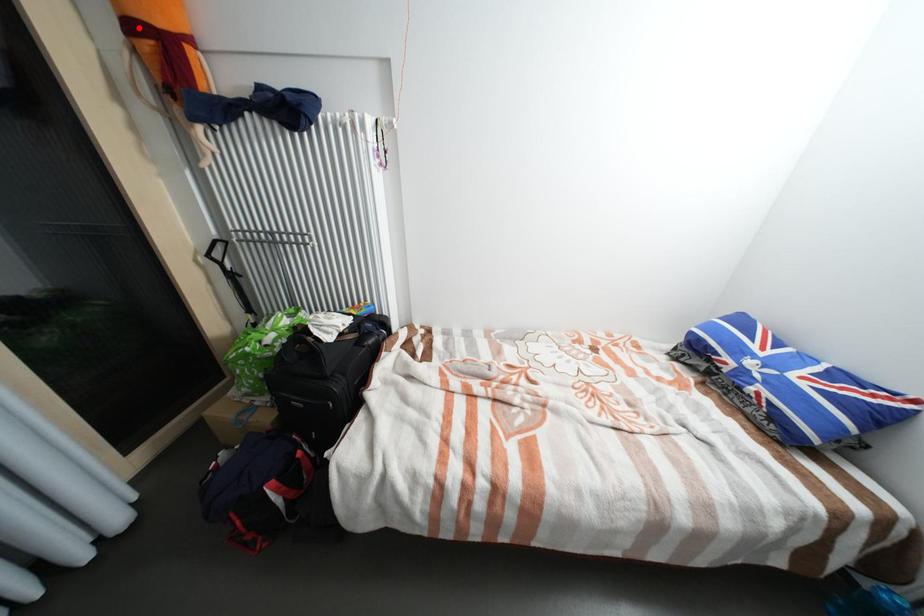
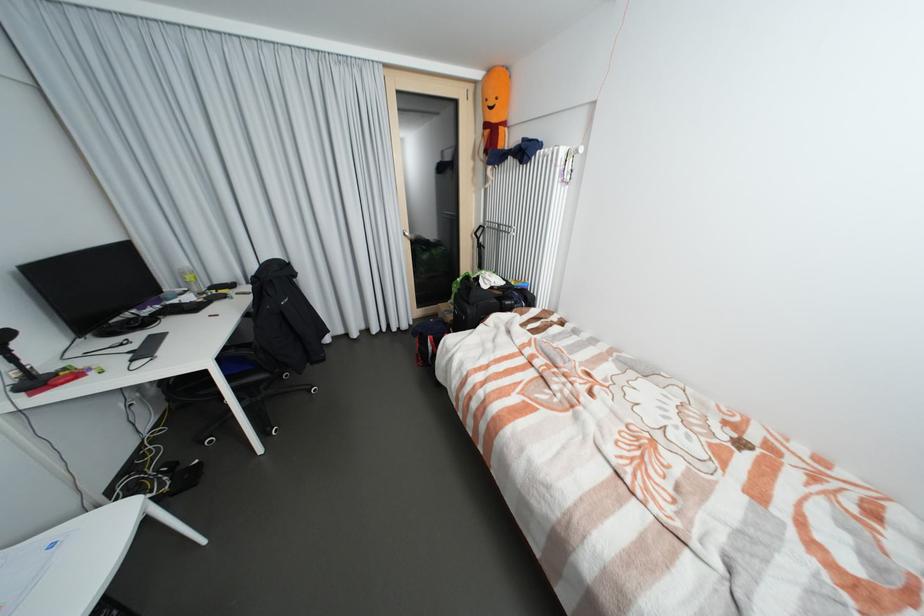
Where in the second image is the point corresponding to the highlighted location from the first image?

(492, 126)